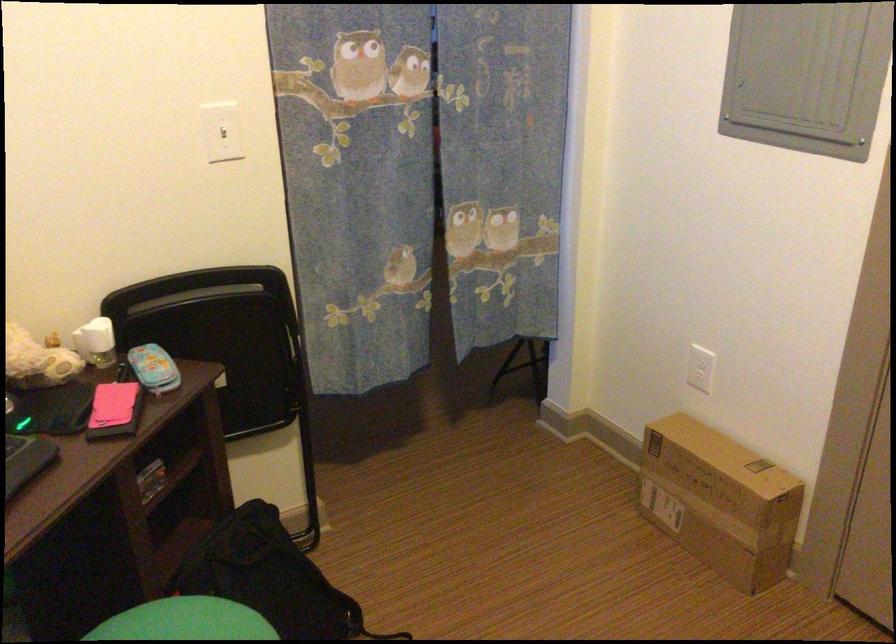
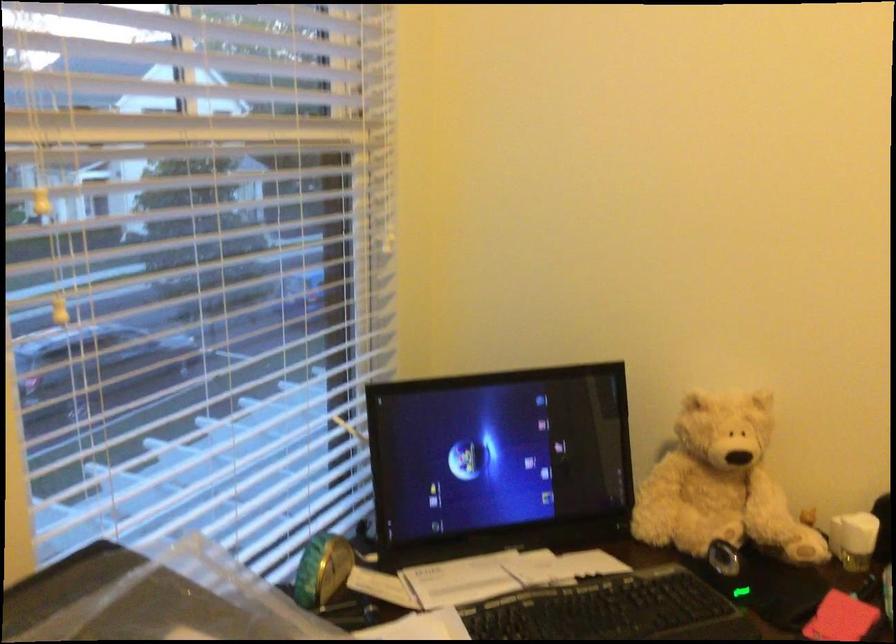
Question: The camera is either moving clockwise (left) or counter-clockwise (right) around the object. The first image is from the beginning of the video and the second image is from the end. Is the camera moving left or right when shooting the video?

Choices:
 (A) Left
 (B) Right

Answer: (B)